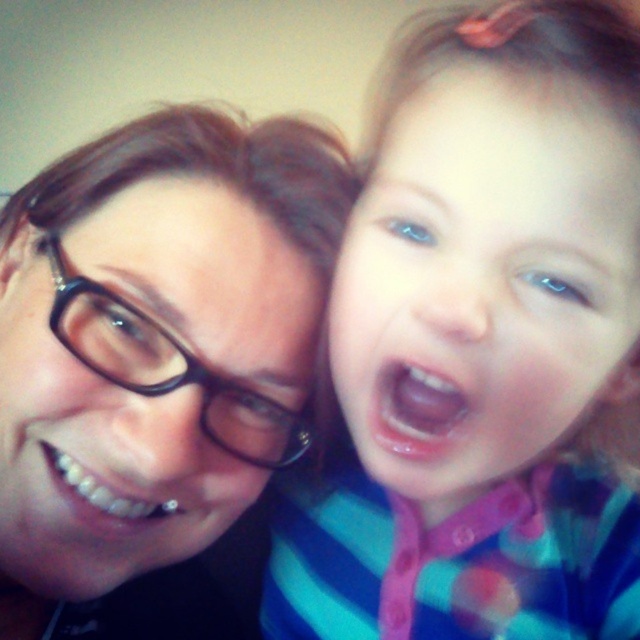
You are a photographer trying to capture a close up of the blue eyes at center and the matte black glasses at left. Which object would require a wider lens aperture to ensure sharp focus due to its size?

The blue eyes at center is thinner than matte black glasses at left, so the matte black glasses at left would require a wider lens aperture to ensure sharp focus because it is larger and might need a shallower depth of field.

You are a photographer trying to focus on the blue eyes at center and the matte black glasses at left in the image. Which object is closer to the camera?

The blue eyes at center is closer to the camera than the matte black glasses at left because it is in front of it.